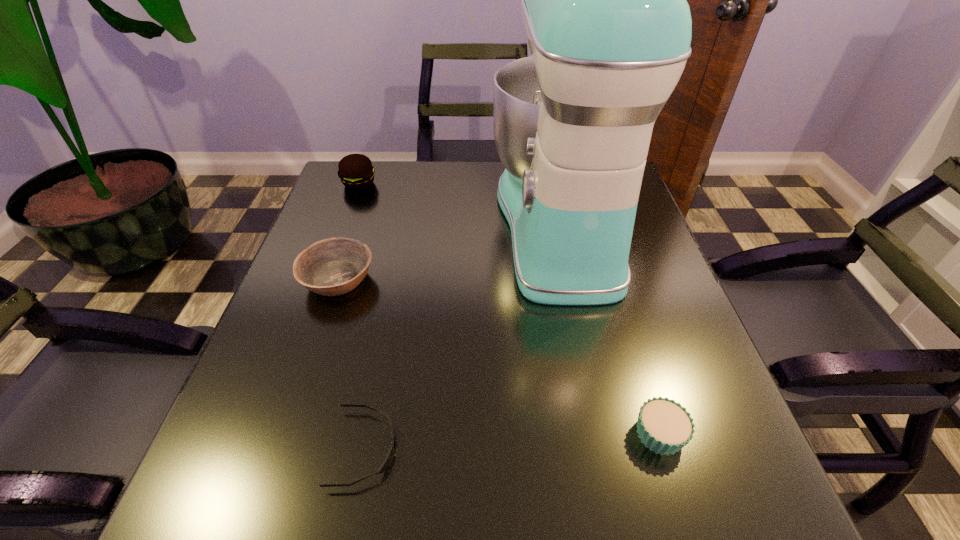
Identify the location of the tallest object. This screenshot has width=960, height=540. (604, 4).

Identify the location of the fourth shortest object. click(356, 172).

The width and height of the screenshot is (960, 540). I want to click on the third tallest object, so click(331, 267).

The height and width of the screenshot is (540, 960). Identify the location of cupcake. click(664, 426).

The height and width of the screenshot is (540, 960). I want to click on the shortest object, so click(x=385, y=464).

This screenshot has height=540, width=960. I want to click on free space located 0.180m at the base of the tallest object, so pyautogui.click(x=420, y=224).

In order to click on blank space located 0.400m at the base of the tallest object in this screenshot , I will do `click(334, 224)`.

You are a GUI agent. You are given a task and a screenshot of the screen. Output one action in this format:
    pyautogui.click(x=<x>, y=<y>)
    Task: Click on the vacant space positioned at the base of the tallest object
    
    Given the screenshot: What is the action you would take?
    (338, 224)

This screenshot has width=960, height=540. Identify the location of vacant space located on the right of the fourth shortest object. coord(476,184).

Locate an element on the screen. This screenshot has height=540, width=960. vacant area located 0.230m on the back of the bowl is located at coordinates (365, 199).